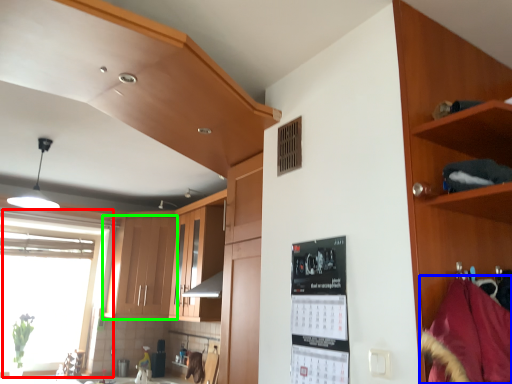
Question: Which is farther away from window (highlighted by a red box)? material (highlighted by a blue box) or cabinetry (highlighted by a green box)?

Choices:
 (A) material
 (B) cabinetry

Answer: (A)